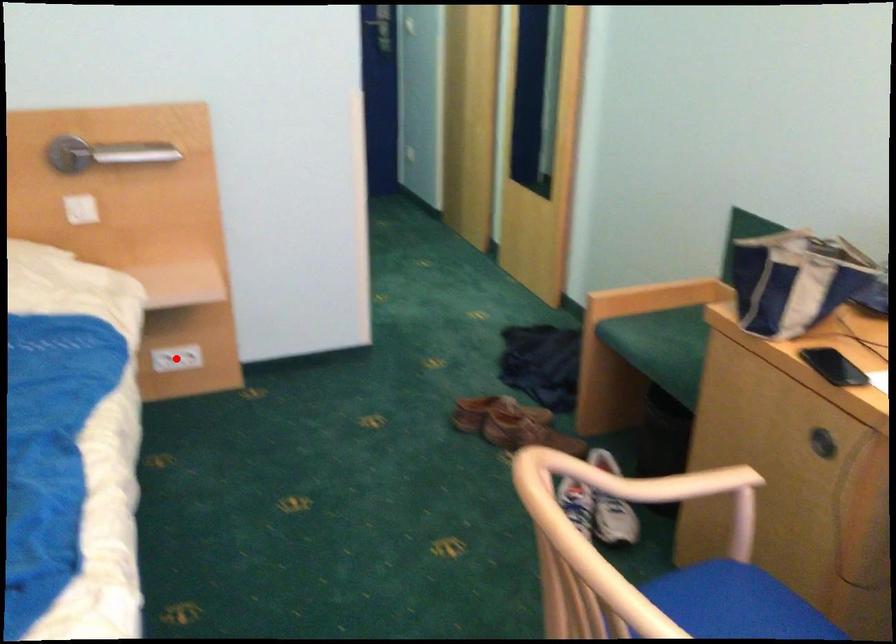
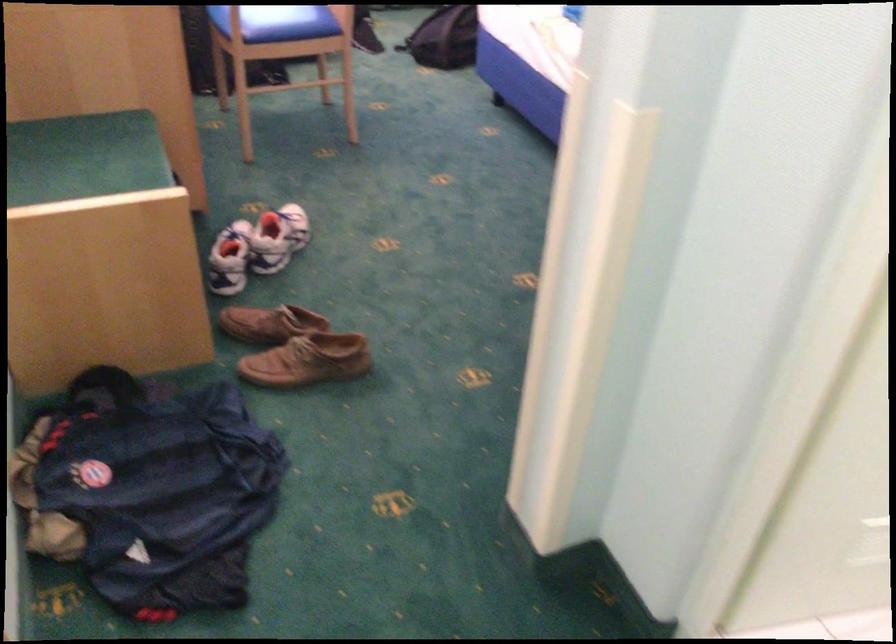
Question: I am providing you with two images of the same scene from different viewpoints. A red point is marked on the first image. At the location where the point appears in image 1, is it still visible in image 2?

Choices:
 (A) Yes
 (B) No

Answer: (B)